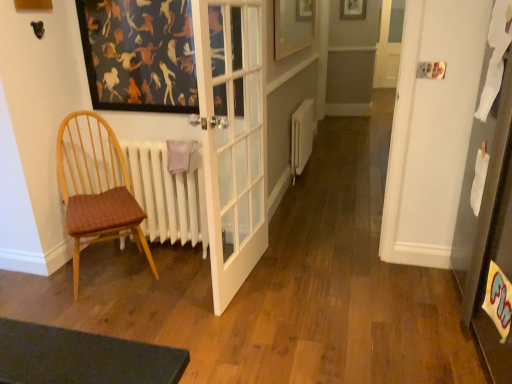
Locate an element on the screen. This screenshot has width=512, height=384. empty space that is in between woven fabric chair at left and white matte radiator at left is located at coordinates (176, 270).